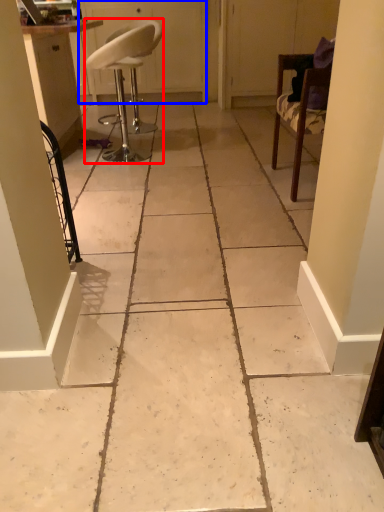
Question: Among these objects, which one is nearest to the camera, chair (highlighted by a red box) or screen door (highlighted by a blue box)?

Choices:
 (A) chair
 (B) screen door

Answer: (A)